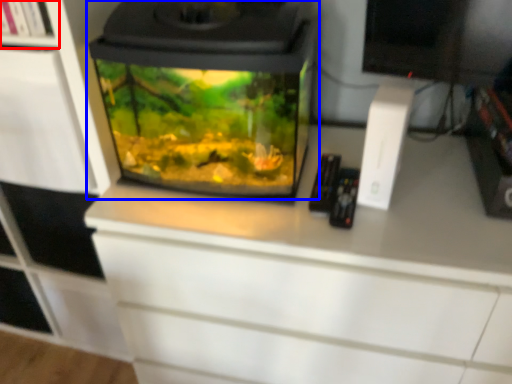
Question: Among these objects, which one is nearest to the camera, shelf (highlighted by a red box) or home appliance (highlighted by a blue box)?

Choices:
 (A) shelf
 (B) home appliance

Answer: (B)